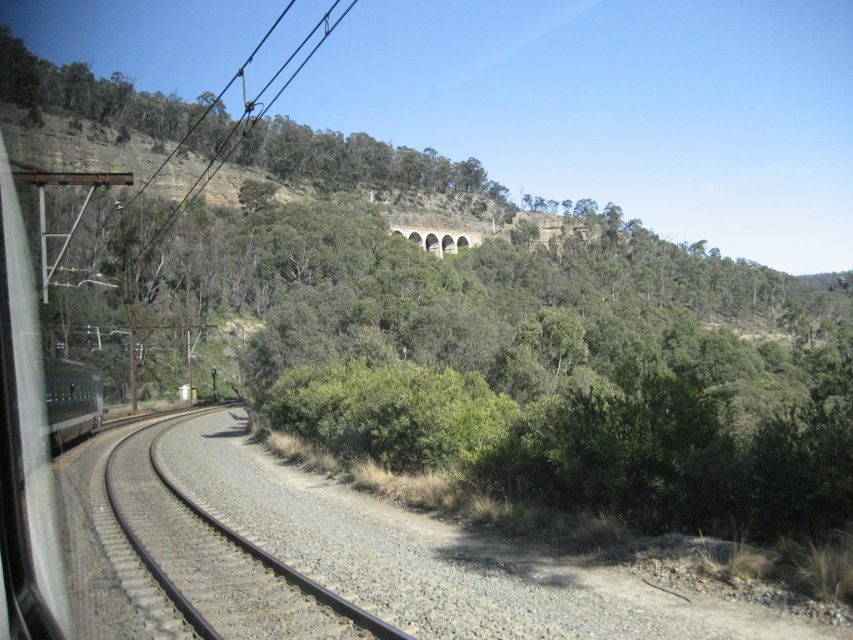
You are standing at the point closer to the viewer in the image. Which point are you at, point (194, 516) or point (70, 433)?

You are at point (194, 516) because it is closer to the viewer than point (70, 433).

You are a passenger on the green matte train at left and want to know how the brown gravel track at center appears in comparison to your train. Is the track shorter or longer than the train?

The brown gravel track at center is shorter than the green matte train at left, so the track appears shorter than the train.

You are a photographer wanting to capture both the brown gravel track at center and the stone arch bridge at upper center in your shot. Which object appears closer to the camera based on their relative heights?

The brown gravel track at center appears closer to the camera since it has a lesser height compared to the stone arch bridge at upper center.